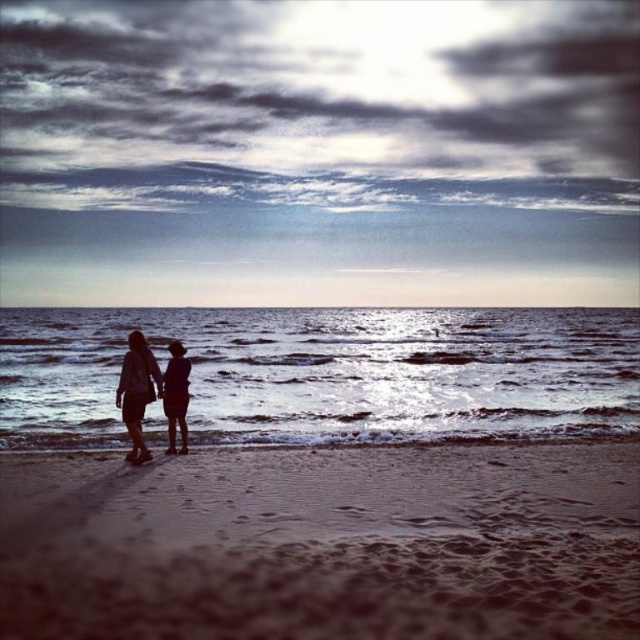
You are a photographer trying to capture the silhouette fabric couple at center and the brown sandy beach at lower center in a single frame. Based on their widths, which object should you position closer to the center of the photo to ensure both are fully visible?

The brown sandy beach at lower center has a lesser width compared to the silhouette fabric couple at center. To ensure both are fully visible, position the silhouette fabric couple at center closer to the center of the photo since it is wider and requires more space.

You are standing on the brown sandy beach at lower center and want to reach the shiny silver water at center. Which direction should you move to get there?

You should move upwards towards the shiny silver water at center because the brown sandy beach at lower center is located below it.

You are a photographer trying to capture the silhouette fabric couple at center and the brown sandy beach at lower center in a single frame. Based on their sizes in the image, which object should you focus on first to ensure both are in focus?

The silhouette fabric couple at center is larger than the brown sandy beach at lower center, so focusing on the larger object first will help ensure both are in focus.